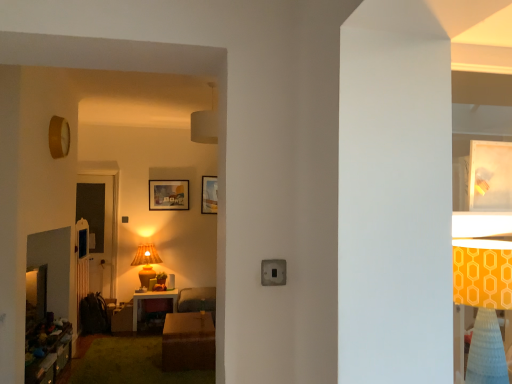
Where is `metallic silver light switch at center`? metallic silver light switch at center is located at coordinates (273, 272).

How much space does matte wooden picture frame at upper center, positioned as the first picture frame in back-to-front order, occupy horizontally?

matte wooden picture frame at upper center, positioned as the first picture frame in back-to-front order, is 1.31 inches wide.

What is the approximate height of matte wooden picture frame at center, which is counted as the third picture frame, starting from the right?

The height of matte wooden picture frame at center, which is counted as the third picture frame, starting from the right, is 17.24 inches.

Locate an element on the screen. orange fabric lampshade at right is located at coordinates (484, 306).

Locate an element on the screen. This screenshot has width=512, height=384. dark glass door at left is located at coordinates (100, 227).

From the image's perspective, between brown wooden table at center, the 2th table viewed from the left, and dark glass door at left, which one is located above?

dark glass door at left appears higher in the image.

Which of these two, brown wooden table at center, the 1th table in the right-to-left sequence, or dark glass door at left, is thinner?

dark glass door at left.

Who is taller, brown wooden table at center, the first table in the front-to-back sequence, or dark glass door at left?

Standing taller between the two is dark glass door at left.

Between orange fabric lampshade at right and dark glass door at left, which one appears on the right side from the viewer's perspective?

orange fabric lampshade at right is more to the right.

From a real-world perspective, which is physically above, orange fabric lampshade at right or dark glass door at left?

In real-world perspective, orange fabric lampshade at right is above.

Is orange fabric lampshade at right smaller than dark glass door at left?

Yes.

How many degrees apart are the facing directions of orange fabric lampshade at right and dark glass door at left?

There is a 0.000347-degree angle between the facing directions of orange fabric lampshade at right and dark glass door at left.

Is matte wooden table at center, which is counted as the 1th table, starting from the back, not near matte wooden picture frame at center, the 2th picture frame positioned from the front?

Yes.

Considering the positions of point (151, 293) and point (188, 200), is point (151, 293) closer or farther from the camera than point (188, 200)?

Point (151, 293) is positioned closer to the camera compared to point (188, 200).

Which object is further away from the camera, matte wooden table at center, which appears as the 1th table when viewed from the left, or matte wooden picture frame at center, which is the 2th picture frame from back to front?

matte wooden picture frame at center, which is the 2th picture frame from back to front, is more distant.

Between matte wooden table at center, which is counted as the 1th table, starting from the back, and matte wooden picture frame at center, which is the 2th picture frame from back to front, which one has smaller width?

With smaller width is matte wooden picture frame at center, which is the 2th picture frame from back to front.

How distant is matte wooden picture frame at upper center, positioned as the first picture frame in back-to-front order, from matte white picture frame at upper right, acting as the third picture frame starting from the left?

matte wooden picture frame at upper center, positioned as the first picture frame in back-to-front order, and matte white picture frame at upper right, acting as the third picture frame starting from the left, are 15.45 feet apart.

Is matte wooden picture frame at upper center, the second picture frame positioned from the left, looking in the opposite direction of matte white picture frame at upper right, the third picture frame positioned from the back?

No.

Where is `the 1st picture frame to the left of the matte white picture frame at upper right, acting as the 1th picture frame starting from the front, starting your count from the anchor`? Image resolution: width=512 pixels, height=384 pixels. the 1st picture frame to the left of the matte white picture frame at upper right, acting as the 1th picture frame starting from the front, starting your count from the anchor is located at coordinates (209, 195).

Can matte white picture frame at upper right, the first picture frame from the right, be found inside matte wooden picture frame at upper center, positioned as the first picture frame in back-to-front order?

No, matte wooden picture frame at upper center, positioned as the first picture frame in back-to-front order, does not contain matte white picture frame at upper right, the first picture frame from the right.

Between matte wooden table at center, which is counted as the 1th table, starting from the back, and matte white picture frame at upper right, acting as the third picture frame starting from the left, which one has smaller size?

With smaller size is matte white picture frame at upper right, acting as the third picture frame starting from the left.

Which is further, [135,329] or [502,204]?

Positioned behind is point [135,329].

Can you confirm if matte wooden table at center, which is counted as the 1th table, starting from the back, is thinner than matte white picture frame at upper right, acting as the 1th picture frame starting from the front?

No.

Considering the relative sizes of matte wooden table at center, which appears as the 1th table when viewed from the left, and matte white picture frame at upper right, acting as the third picture frame starting from the left, in the image provided, is matte wooden table at center, which appears as the 1th table when viewed from the left, shorter than matte white picture frame at upper right, acting as the third picture frame starting from the left,?

No.

Is matte white picture frame at upper right, the third picture frame positioned from the back, wider or thinner than dark glass door at left?

matte white picture frame at upper right, the third picture frame positioned from the back, is thinner than dark glass door at left.

Does matte white picture frame at upper right, the third picture frame positioned from the back, touch dark glass door at left?

matte white picture frame at upper right, the third picture frame positioned from the back, is not next to dark glass door at left, and they're not touching.

From the image's perspective, is matte white picture frame at upper right, the first picture frame from the right, on top of dark glass door at left?

Yes.

Which object is closer to the camera taking this photo, matte white picture frame at upper right, acting as the third picture frame starting from the left, or dark glass door at left?

matte white picture frame at upper right, acting as the third picture frame starting from the left, is closer to the camera.

From the image's perspective, which is above, matte wooden picture frame at center, the 2th picture frame positioned from the front, or orange fabric lampshade at right?

matte wooden picture frame at center, the 2th picture frame positioned from the front, appears higher in the image.

Which object is positioned more to the left, matte wooden picture frame at center, the 2th picture frame positioned from the front, or orange fabric lampshade at right?

From the viewer's perspective, matte wooden picture frame at center, the 2th picture frame positioned from the front, appears more on the left side.

From a real-world perspective, which object rests below the other?

From a 3D spatial view, orange fabric lampshade at right is below.

Does matte wooden picture frame at center, which is counted as the third picture frame, starting from the right, lie behind orange fabric lampshade at right?

That is True.

Find the location of a particular element. The image size is (512, 384). glass door on the left of the brown wooden table at center, which appears as the 2th table when viewed from the back is located at coordinates (100, 227).

You are a GUI agent. You are given a task and a screenshot of the screen. Output one action in this format:
    pyautogui.click(x=<x>, y=<y>)
    Task: Click on the glass door that is behind the orange fabric lampshade at right
    Image resolution: width=512 pixels, height=384 pixels.
    Given the screenshot: What is the action you would take?
    pyautogui.click(x=100, y=227)

Looking at the image, which one is located further to matte wooden picture frame at upper center, which is counted as the 3th picture frame, starting from the front, matte wooden table at center, the second table when ordered from right to left, or matte white picture frame at upper right, the first picture frame from the right?

The object further to matte wooden picture frame at upper center, which is counted as the 3th picture frame, starting from the front, is matte white picture frame at upper right, the first picture frame from the right.

From the image, which object appears to be farther from matte wooden picture frame at upper center, which is the 2th picture frame from right to left, orange fabric lampshade at right or matte wooden picture frame at center, which is counted as the third picture frame, starting from the right?

orange fabric lampshade at right lies further to matte wooden picture frame at upper center, which is the 2th picture frame from right to left, than the other object.

Estimate the real-world distances between objects in this image. Which object is closer to orange fabric lampshade at right, matte white picture frame at upper right, acting as the third picture frame starting from the left, or matte wooden picture frame at upper center, positioned as the first picture frame in back-to-front order?

The object closer to orange fabric lampshade at right is matte white picture frame at upper right, acting as the third picture frame starting from the left.

Based on their spatial positions, is matte wooden picture frame at upper center, positioned as the first picture frame in back-to-front order, or matte wooden table at center, arranged as the second table when viewed from the front, closer to orange fabric lampshade at right?

matte wooden table at center, arranged as the second table when viewed from the front, is closer to orange fabric lampshade at right.

Which object lies further to the anchor point wooden dresser at lower left, matte wooden table at center, which is counted as the 1th table, starting from the back, or orange fabric lampshade at right?

orange fabric lampshade at right is further to wooden dresser at lower left.

Which object lies further to the anchor point matte wooden picture frame at center, which is the 2th picture frame from back to front, matte white picture frame at upper right, acting as the third picture frame starting from the left, or matte wooden picture frame at upper center, which is the 2th picture frame from right to left?

Based on the image, matte white picture frame at upper right, acting as the third picture frame starting from the left, appears to be further to matte wooden picture frame at center, which is the 2th picture frame from back to front.

Estimate the real-world distances between objects in this image. Which object is further from matte brown table lamp at center, metallic silver light switch at center or matte white picture frame at upper right, acting as the 1th picture frame starting from the front?

Among the two, matte white picture frame at upper right, acting as the 1th picture frame starting from the front, is located further to matte brown table lamp at center.

Estimate the real-world distances between objects in this image. Which object is further from matte wooden table at center, arranged as the second table when viewed from the front, brown wooden table at center, the first table in the front-to-back sequence, or matte wooden picture frame at center, which is counted as the third picture frame, starting from the right?

brown wooden table at center, the first table in the front-to-back sequence, is positioned further to the anchor matte wooden table at center, arranged as the second table when viewed from the front.

The image size is (512, 384). I want to click on glass door located between wooden dresser at lower left and matte wooden picture frame at center, which is counted as the third picture frame, starting from the right, in the depth direction, so click(100, 227).

I want to click on picture frame between orange fabric lampshade at right and matte wooden table at center, which is counted as the 1th table, starting from the back, in the front-back direction, so click(490, 176).

Where is `dresser positioned between orange fabric lampshade at right and matte brown table lamp at center from near to far`? dresser positioned between orange fabric lampshade at right and matte brown table lamp at center from near to far is located at coordinates (47, 351).

Locate an element on the screen. The image size is (512, 384). glass door between orange fabric lampshade at right and matte wooden picture frame at upper center, positioned as the first picture frame in back-to-front order, along the z-axis is located at coordinates (100, 227).